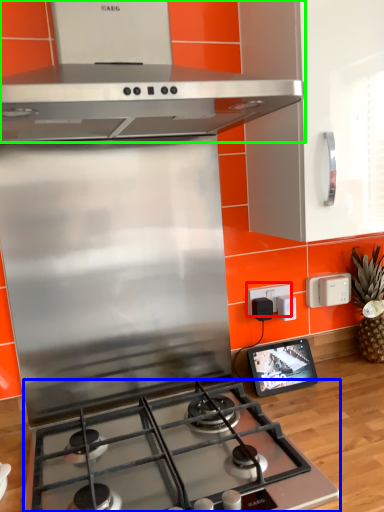
Question: Considering the real-world distances, which object is farthest from electric outlet (highlighted by a red box)? gas stove (highlighted by a blue box) or home appliance (highlighted by a green box)?

Choices:
 (A) gas stove
 (B) home appliance

Answer: (B)